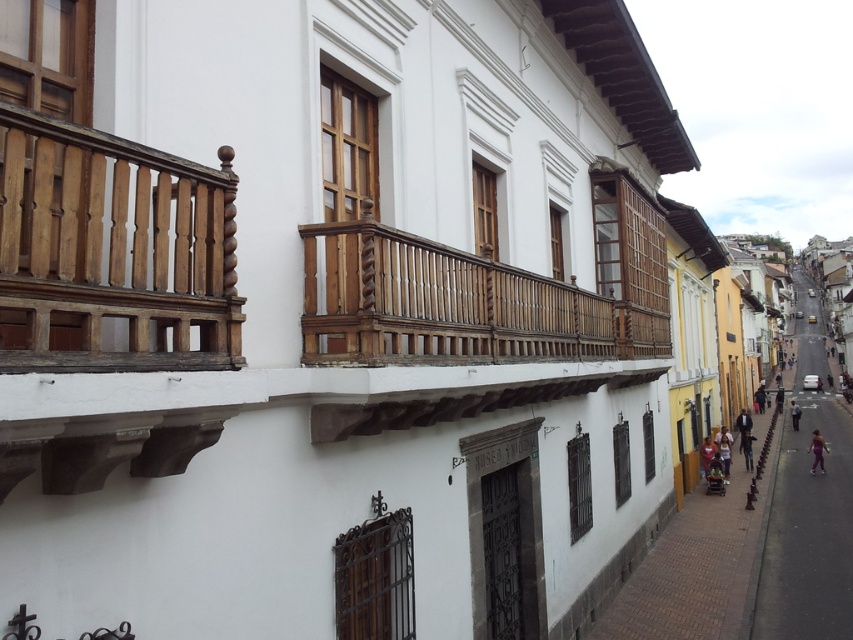
Question: Which point is farther to the camera?

Choices:
 (A) purple fabric pants at lower right
 (B) wooden polished balcony at upper left
 (C) asphalt road at lower right
 (D) light blue jeans at lower right

Answer: (D)

Question: Which point is farther from the camera taking this photo?

Choices:
 (A) (791, 413)
 (B) (822, 497)

Answer: (A)

Question: Among these points, which one is nearest to the camera?

Choices:
 (A) pos(125,301)
 (B) pos(798,413)
 (C) pos(416,276)

Answer: (A)

Question: Can you confirm if purple fabric pants at lower right is thinner than light blue jeans at lower right?

Choices:
 (A) no
 (B) yes

Answer: (B)

Question: Can you confirm if wooden polished balcony at upper left is positioned below wooden at center?

Choices:
 (A) no
 (B) yes

Answer: (A)

Question: Is wooden at center to the left of asphalt road at lower right from the viewer's perspective?

Choices:
 (A) yes
 (B) no

Answer: (A)